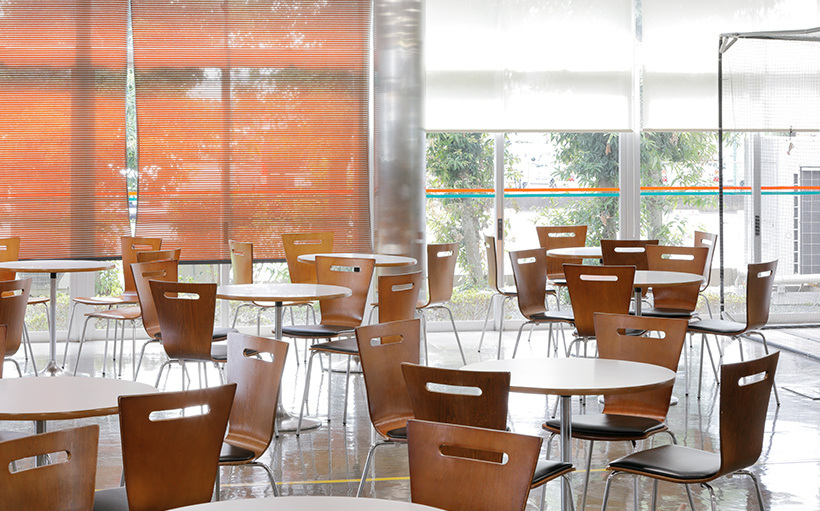
The height and width of the screenshot is (511, 820). I want to click on tables, so click(42, 266), click(66, 397), click(279, 287), click(395, 258), click(552, 371), click(658, 280), click(567, 252).